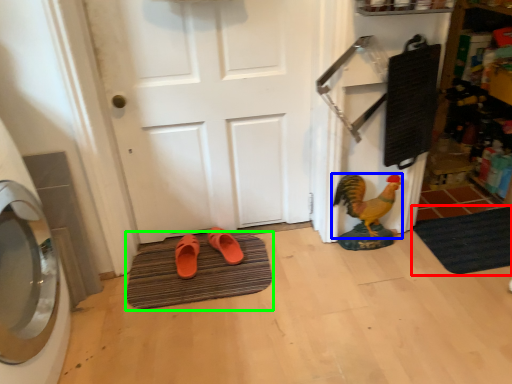
Question: Based on their relative distances, which object is farther from bath mat (highlighted by a red box)? Choose from chicken (highlighted by a blue box) and bath mat (highlighted by a green box).

Choices:
 (A) chicken
 (B) bath mat

Answer: (B)